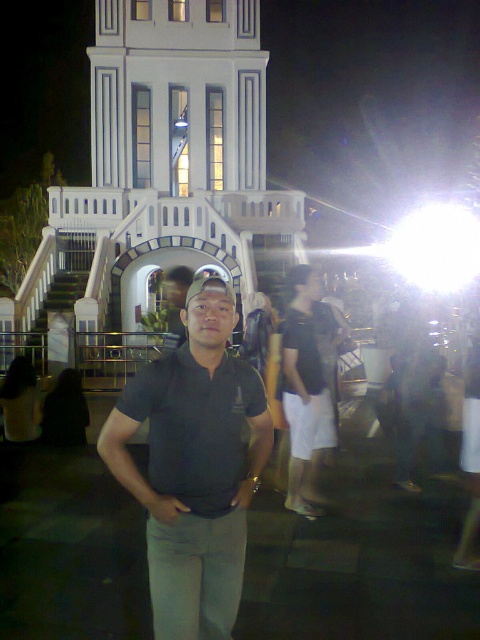
Does point (104, 22) come farther from viewer compared to point (155, 545)?

That is True.

Where is `white smooth tower at center`? white smooth tower at center is located at coordinates (164, 168).

Is point (192, 262) more distant than point (265, 444)?

That is True.

Locate an element on the screen. This screenshot has height=640, width=480. white smooth tower at center is located at coordinates (164, 168).

Between point (165, 371) and point (141, 410), which one is positioned behind?

The point (165, 371) is more distant.

Is the position of matte black polo shirt at center less distant than that of dark gray cotton polo shirt at center?

Yes.

Between point (225, 323) and point (196, 464), which one is positioned behind?

The point (225, 323) is more distant.

Where is `matte black polo shirt at center`? matte black polo shirt at center is located at coordinates (193, 467).

Who is positioned more to the right, white smooth tower at center or dark gray cotton polo shirt at center?

From the viewer's perspective, dark gray cotton polo shirt at center appears more on the right side.

Which is behind, point (99, 90) or point (189, 378)?

Positioned behind is point (99, 90).

Is point (275, 250) behind point (187, 490)?

Yes, point (275, 250) is behind point (187, 490).

This screenshot has height=640, width=480. What are the coordinates of `white smooth tower at center` in the screenshot? It's located at (164, 168).